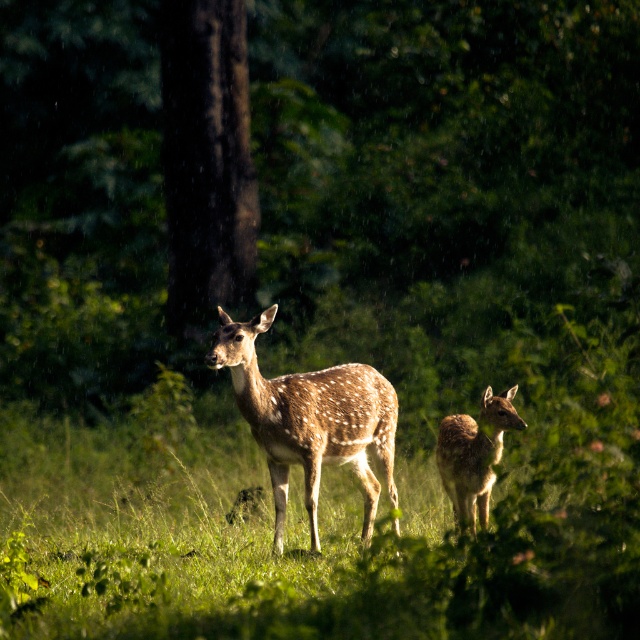
Question: Which of the following is the closest to the observer?

Choices:
 (A) (481, 480)
 (B) (348, 369)
 (C) (248, 285)

Answer: (A)

Question: Which object is the closest to the spotted fur deer at right?

Choices:
 (A) brown textured tree at center
 (B) spotted fur deer at center

Answer: (B)

Question: Which point is farther from the camera taking this photo?

Choices:
 (A) (244, 372)
 (B) (486, 396)

Answer: (A)

Question: Is brown textured tree at center in front of spotted fur deer at center?

Choices:
 (A) no
 (B) yes

Answer: (A)

Question: Does spotted fur deer at center have a lesser width compared to spotted fur deer at right?

Choices:
 (A) no
 (B) yes

Answer: (A)

Question: Can you confirm if brown textured tree at center is positioned to the right of spotted fur deer at center?

Choices:
 (A) yes
 (B) no

Answer: (B)